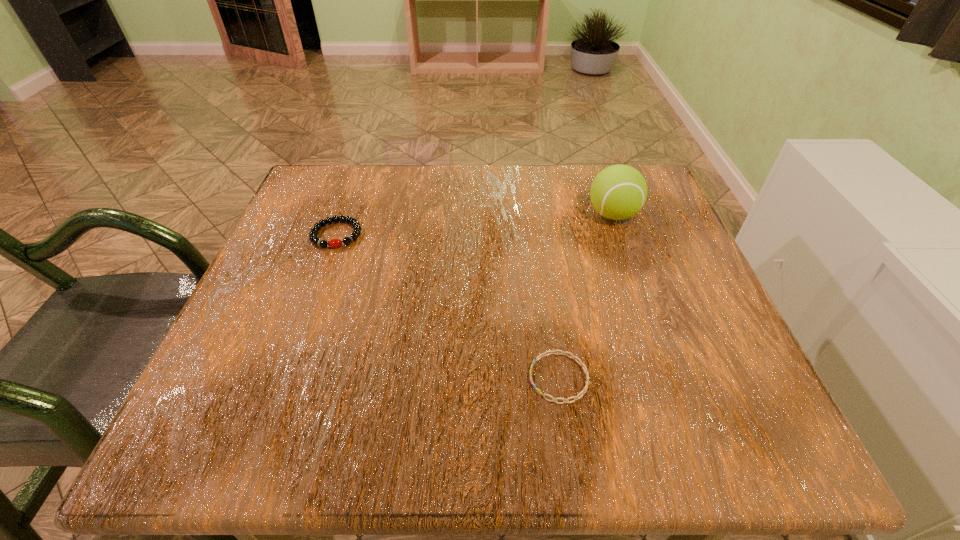
The height and width of the screenshot is (540, 960). In order to click on vacant space located on the surface of the shorter bracelet showing star-shaped elements in this screenshot , I will do `click(308, 378)`.

You are a GUI agent. You are given a task and a screenshot of the screen. Output one action in this format:
    pyautogui.click(x=<x>, y=<y>)
    Task: Click on the tennis ball that is at the far edge
    This screenshot has height=540, width=960.
    Given the screenshot: What is the action you would take?
    pyautogui.click(x=618, y=192)

Locate an element on the screen. Image resolution: width=960 pixels, height=540 pixels. bracelet positioned at the far edge is located at coordinates (355, 224).

Identify the location of object located in the near edge section of the desktop. (581, 363).

Where is `object that is at the left edge`? object that is at the left edge is located at coordinates (355, 224).

Locate an element on the screen. This screenshot has height=540, width=960. object present at the right edge is located at coordinates (618, 192).

The height and width of the screenshot is (540, 960). In order to click on object that is at the far left corner in this screenshot , I will do `click(355, 224)`.

This screenshot has height=540, width=960. I want to click on object present at the far right corner, so click(618, 192).

Find the location of `vacant space at the far edge of the desktop`. vacant space at the far edge of the desktop is located at coordinates (521, 190).

The image size is (960, 540). I want to click on vacant area at the near edge, so click(x=378, y=404).